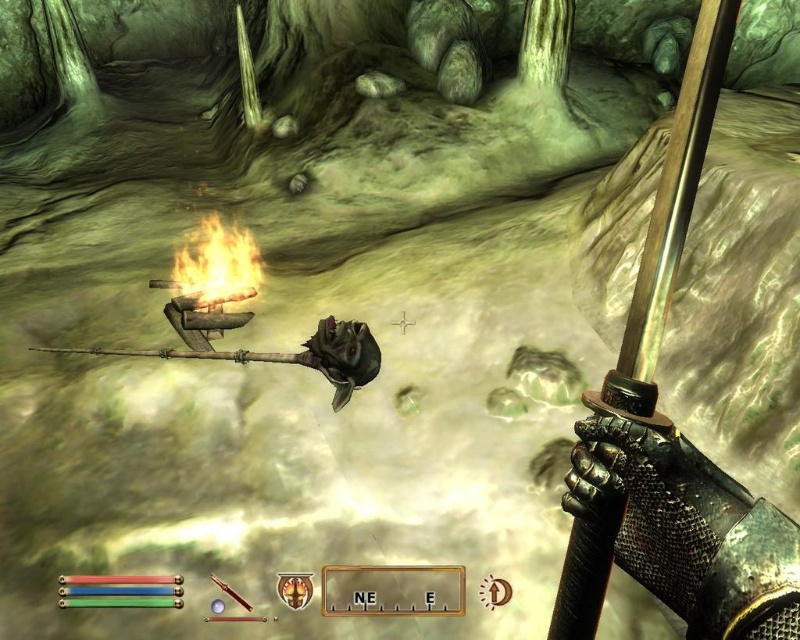
Question: Which point is closer to the camera?

Choices:
 (A) (720, 17)
 (B) (232, 284)

Answer: (A)

Question: Among these objects, which one is farthest from the camera?

Choices:
 (A) polished steel sword at right
 (B) flaming wood at center

Answer: (B)

Question: Does polished steel sword at right have a lesser width compared to flaming wood at center?

Choices:
 (A) yes
 (B) no

Answer: (A)

Question: Does polished steel sword at right have a greater width compared to flaming wood at center?

Choices:
 (A) yes
 (B) no

Answer: (B)

Question: Does polished steel sword at right have a larger size compared to flaming wood at center?

Choices:
 (A) no
 (B) yes

Answer: (A)